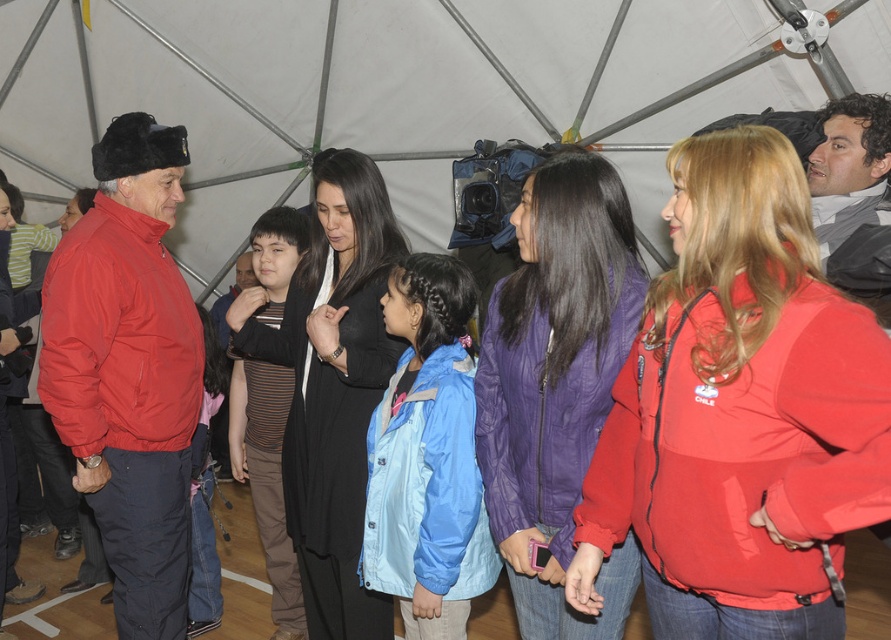
You are standing inside the tent and want to locate the purple quilted jacket at center. Based on the white fabric canopy at upper center, which direction should you look relative to the canopy?

The purple quilted jacket at center is to the right of the white fabric canopy at upper center, so you should look to the right of the canopy to find it.